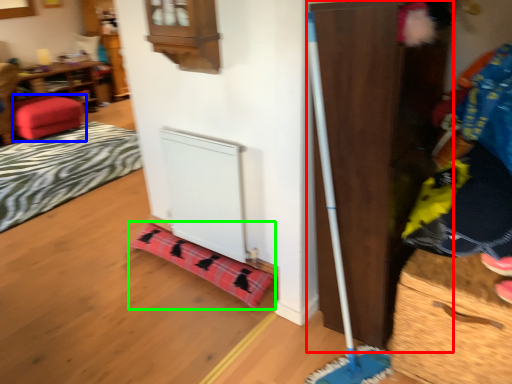
Question: Which object is the closest to the dresser (highlighted by a red box)? Choose among these: furniture (highlighted by a blue box) or blanket (highlighted by a green box).

Choices:
 (A) furniture
 (B) blanket

Answer: (B)